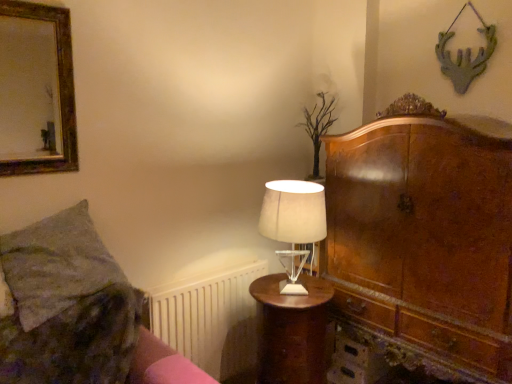
Question: Is point (30, 292) positioned closer to the camera than point (66, 11)?

Choices:
 (A) farther
 (B) closer

Answer: (B)

Question: Is green textured pillow at left wider or thinner than gold-framed mirror at upper left?

Choices:
 (A) wide
 (B) thin

Answer: (A)

Question: Which object is the closest to the green textured pillow at left?

Choices:
 (A) white plastic radiator at lower left
 (B) gold-framed mirror at upper left
 (C) translucent glass table lamp at center
 (D) pink fabric bed frame at lower left
 (E) mahogany wood nightstand at center

Answer: (D)

Question: Estimate the real-world distances between objects in this image. Which object is farther from the white plastic radiator at lower left?

Choices:
 (A) mahogany wood nightstand at center
 (B) gold-framed mirror at upper left
 (C) pink fabric bed frame at lower left
 (D) translucent glass table lamp at center
 (E) green textured pillow at left

Answer: (B)